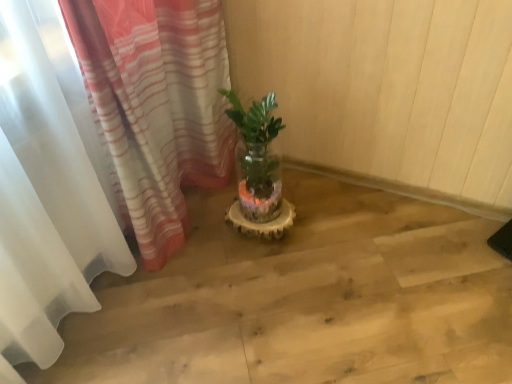
What is the approximate height of translucent glass vase at center?

The height of translucent glass vase at center is 60.21 centimeters.

Measure the distance between point (277, 184) and camera.

The distance of point (277, 184) from camera is 1.85 meters.

Describe the element at coordinates (257, 157) in the screenshot. The image size is (512, 384). I see `translucent glass vase at center` at that location.

The image size is (512, 384). Identify the location of translucent glass vase at center. (257, 157).

At what (x,y) coordinates should I click in order to perform the action: click on translucent glass vase at center. Please return your answer as a coordinate pair (x, y). The width and height of the screenshot is (512, 384). Looking at the image, I should click on (257, 157).